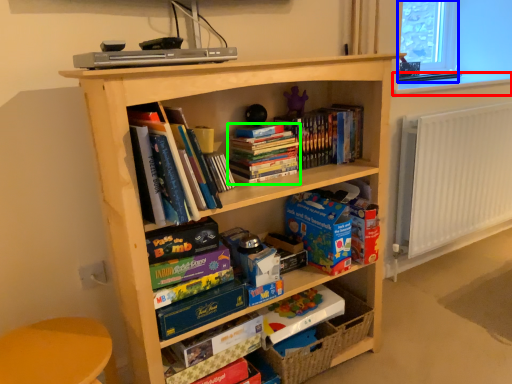
Question: Considering the real-world distances, which object is closest to window sill (highlighted by a red box)? window screen (highlighted by a blue box) or book (highlighted by a green box).

Choices:
 (A) window screen
 (B) book

Answer: (A)